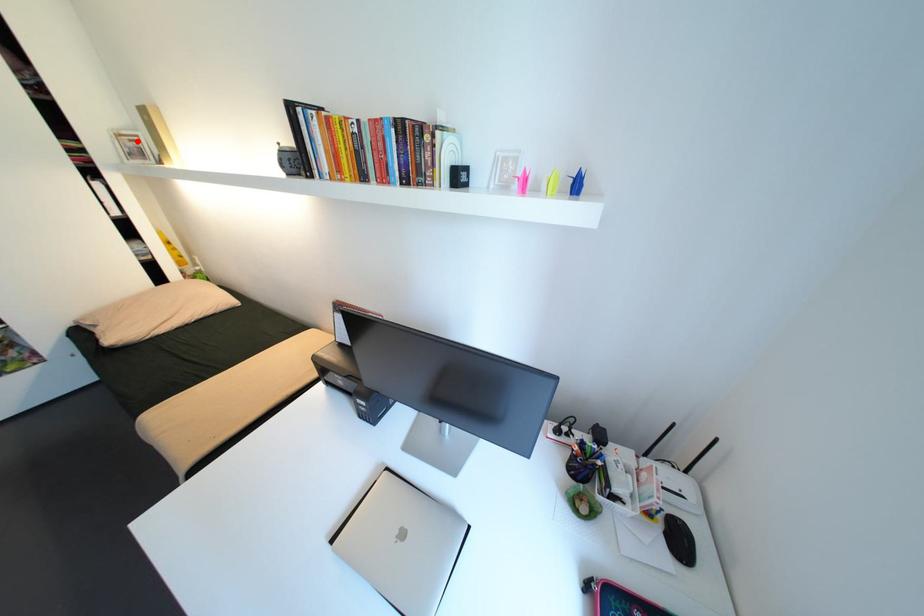
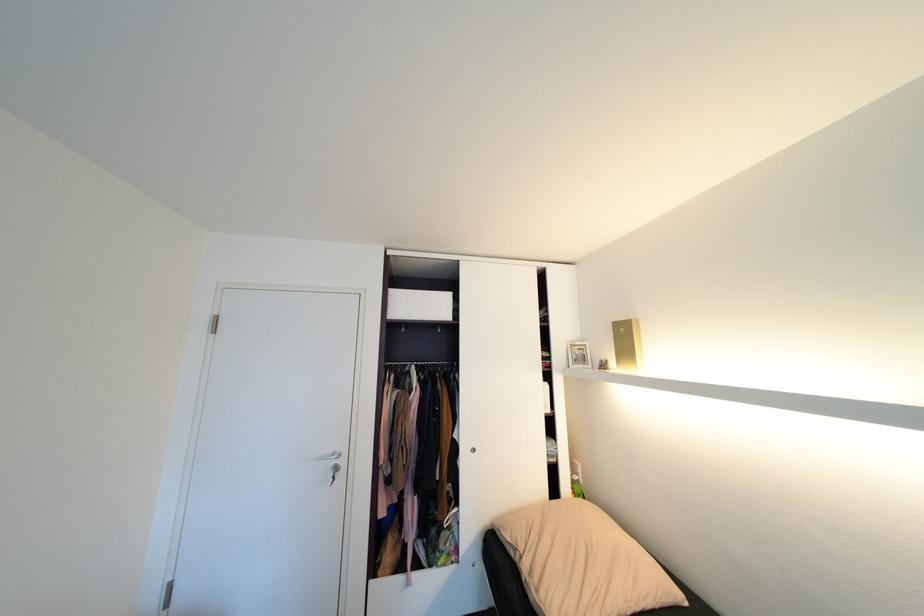
The point at the highlighted location is marked in the first image. Where is the corresponding point in the second image?

(587, 350)